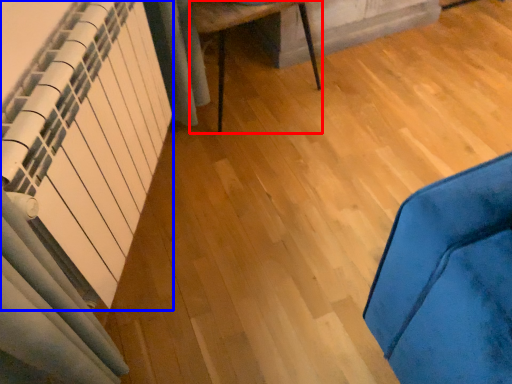
Question: Which object appears farthest to the camera in this image, furniture (highlighted by a red box) or radiator (highlighted by a blue box)?

Choices:
 (A) furniture
 (B) radiator

Answer: (A)